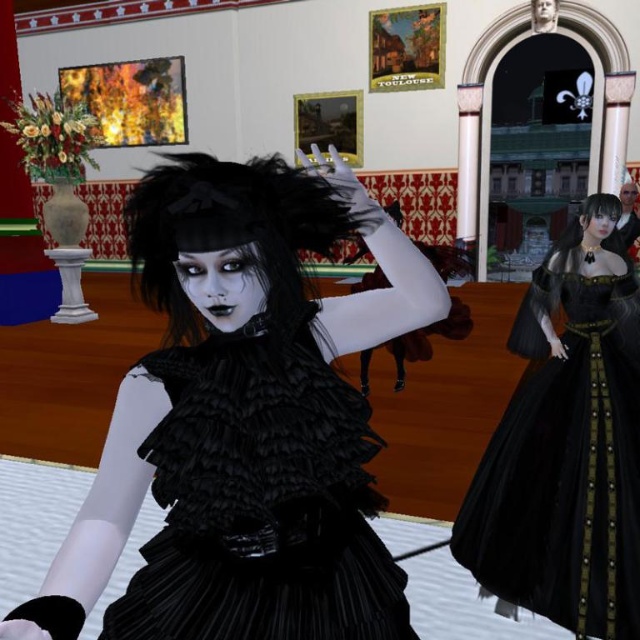
You are a fashion designer observing a runway show. You notice two dresses in the scene. The first is a matte black dress at center, and the second is a black satin gown at right. Based on their positions, which dress is closer to the front of the runway?

The matte black dress at center is closer to the front of the runway because it is positioned above the black satin gown at right, indicating it is in a more forward position.

You are standing in the room and want to take a photo of the point at coordinates [289,173]. The camera you are using has a minimum focus distance of 3 feet. Will the camera be able to focus on the point?

The point at coordinates [289,173] is 3.32 feet from the camera, which is beyond the minimum focus distance of 3 feet. Therefore, the camera should be able to focus on the point.

You are a fashion designer who needs to place a 6 feet long runway between the matte black dress at center and the black satin gown at right. Is there enough space to fit the runway between them?

The distance between the matte black dress at center and the black satin gown at right is 5.02 feet, which is less than the required 6 feet. Therefore, the runway cannot be placed between them.